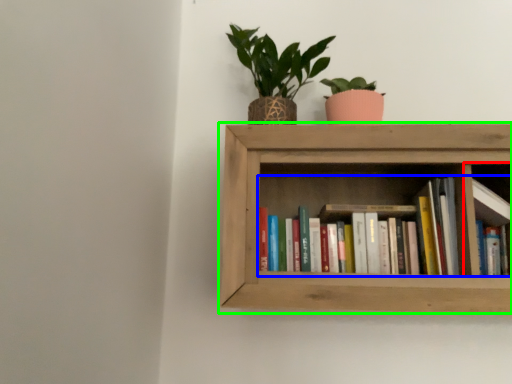
Question: Considering the real-world distances, which object is closest to cabinet (highlighted by a red box)? book (highlighted by a blue box) or shelf (highlighted by a green box).

Choices:
 (A) book
 (B) shelf

Answer: (A)